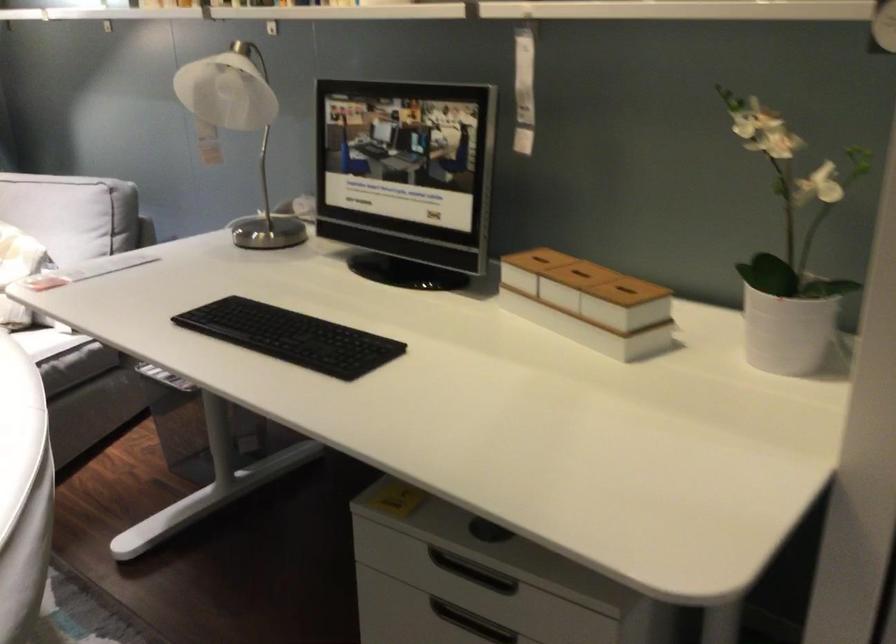
The location [291,337] corresponds to which object?

It refers to a black keyboard.